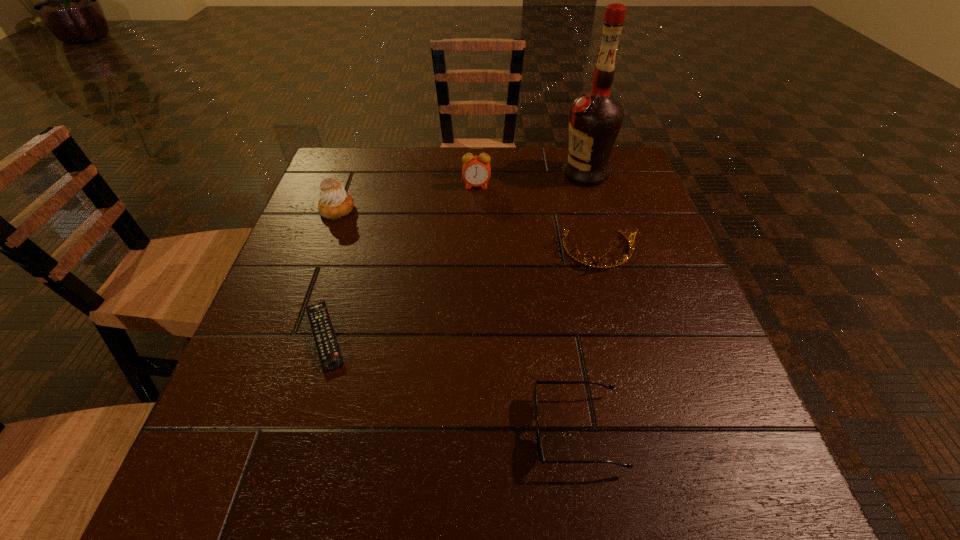
Where is `vacant point located between the fifth shortest object and the nearest object`? vacant point located between the fifth shortest object and the nearest object is located at coordinates (527, 308).

This screenshot has height=540, width=960. What are the coordinates of `vacant region between the remote control and the liquor` in the screenshot? It's located at (455, 255).

This screenshot has height=540, width=960. I want to click on vacant area that lies between the nearest object and the liquor, so click(581, 302).

You are a GUI agent. You are given a task and a screenshot of the screen. Output one action in this format:
    pyautogui.click(x=<x>, y=<y>)
    Task: Click on the unoccupied area between the fifth tallest object and the shortest object
    This screenshot has width=960, height=540.
    Given the screenshot: What is the action you would take?
    pyautogui.click(x=451, y=383)

Point out which object is positioned as the second nearest to the tallest object. Please provide its 2D coordinates. Your answer should be formatted as a tuple, i.e. [(x, y)], where the tuple contains the x and y coordinates of a point satisfying the conditions above.

[(476, 171)]

You are a GUI agent. You are given a task and a screenshot of the screen. Output one action in this format:
    pyautogui.click(x=<x>, y=<y>)
    Task: Click on the object that can be found as the fifth closest to the tiara
    The height and width of the screenshot is (540, 960).
    Given the screenshot: What is the action you would take?
    pyautogui.click(x=335, y=202)

Where is `vacant region that satisfies the following two spatial constraints: 1. on the front and back of the tallest object; 2. on the face of the alarm clock`? This screenshot has height=540, width=960. vacant region that satisfies the following two spatial constraints: 1. on the front and back of the tallest object; 2. on the face of the alarm clock is located at coordinates (588, 186).

The height and width of the screenshot is (540, 960). I want to click on free space that satisfies the following two spatial constraints: 1. on the front and back of the tallest object; 2. on the front side of the fifth farthest object, so click(634, 336).